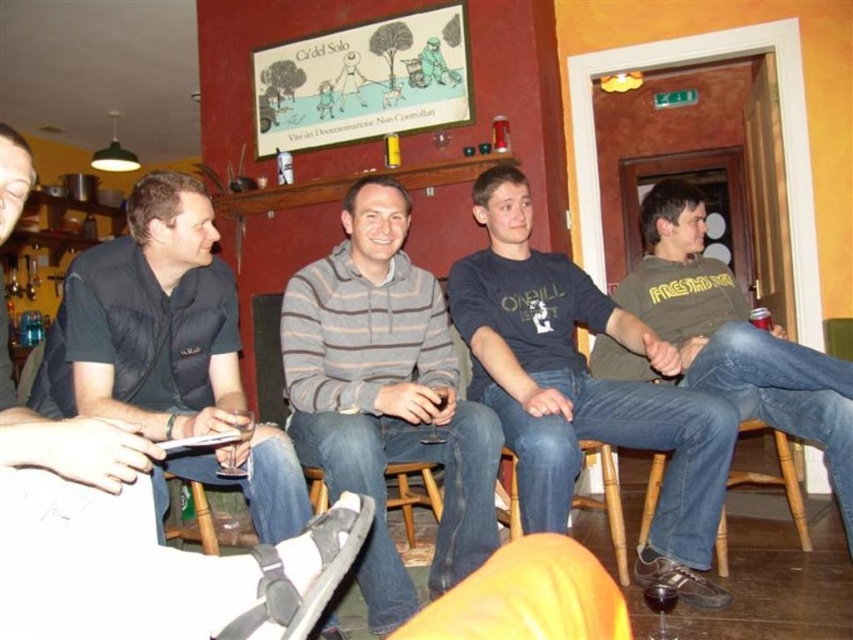
Does brown wooden stool at lower right have a lesser height compared to wooden stool at lower center?

No.

Is brown wooden stool at lower right positioned behind wooden stool at lower center?

Yes, it is behind wooden stool at lower center.

Is point (640, 518) in front of point (413, 531)?

That is False.

Identify the location of brown wooden stool at lower right. (776, 477).

This screenshot has height=640, width=853. Describe the element at coordinates (527, 596) in the screenshot. I see `yellow leather jacket at lower center` at that location.

Does yellow leather jacket at lower center appear on the left side of brown wooden stool at lower right?

Indeed, yellow leather jacket at lower center is positioned on the left side of brown wooden stool at lower right.

At what (x,y) coordinates should I click in order to perform the action: click on yellow leather jacket at lower center. Please return your answer as a coordinate pair (x, y). The image size is (853, 640). Looking at the image, I should click on (527, 596).

What are the coordinates of `yellow leather jacket at lower center` in the screenshot? It's located at (527, 596).

Is point (585, 493) farther from viewer compared to point (795, 472)?

Yes, it is behind point (795, 472).

Who is shorter, wooden chair at center or brown wooden stool at lower right?

Standing shorter between the two is brown wooden stool at lower right.

Find the location of a particular element. wooden chair at center is located at coordinates (605, 500).

This screenshot has height=640, width=853. What are the coordinates of `wooden chair at center` in the screenshot? It's located at (605, 500).